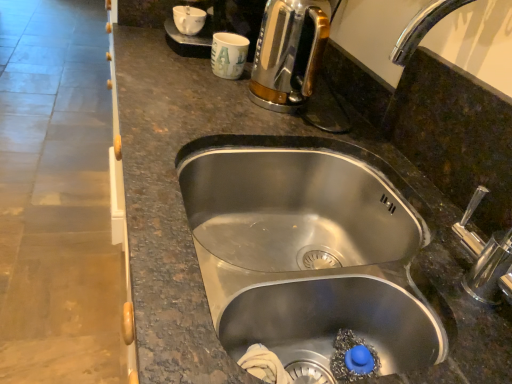
Question: From the image's perspective, is white glossy coffee cup at upper center, marked as the 2th coffee cup in a right-to-left arrangement, above or below white paper cup at upper center, which ranks as the 2th coffee cup in left-to-right order?

Choices:
 (A) below
 (B) above

Answer: (B)

Question: Visually, is white glossy coffee cup at upper center, marked as the 2th coffee cup in a right-to-left arrangement, positioned to the left or to the right of white paper cup at upper center, the first coffee cup ordered from the bottom?

Choices:
 (A) left
 (B) right

Answer: (A)

Question: Which of these objects is positioned closest to the shiny metallic kettle at upper right?

Choices:
 (A) white glossy coffee cup at upper center, marked as the 2th coffee cup in a right-to-left arrangement
 (B) white paper cup at upper center, which ranks as the 2th coffee cup in left-to-right order
 (C) stainless steel sink at center

Answer: (B)

Question: Which is farther from the shiny metallic kettle at upper right?

Choices:
 (A) white paper cup at upper center, which ranks as the 2th coffee cup in left-to-right order
 (B) white glossy coffee cup at upper center, which is the 1th coffee cup in left-to-right order
 (C) stainless steel sink at center

Answer: (B)